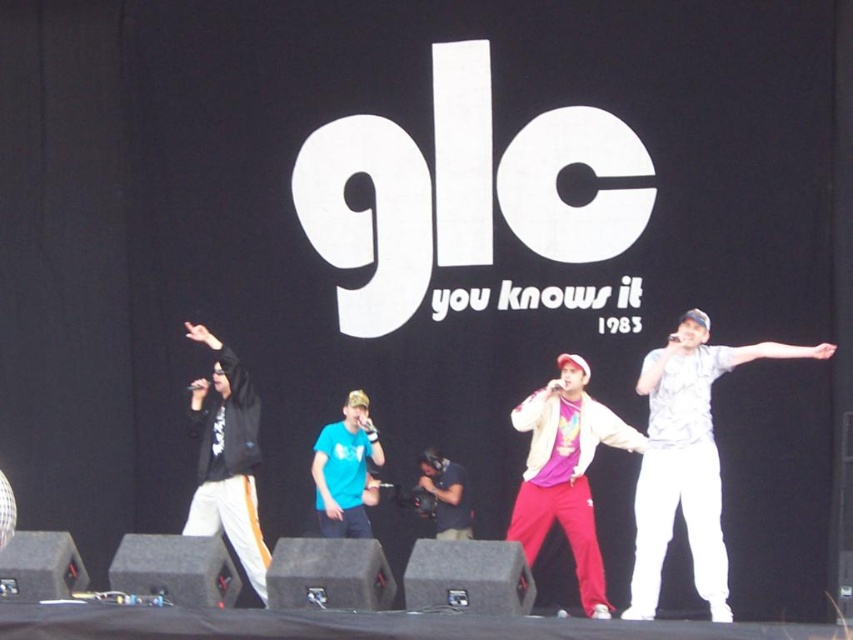
You are a photographer at the back of the venue and want to capture a clear photo of both the matte pink shirt at center and the black matte jacket at left. Considering their sizes, which one should you focus on first to ensure it fits within your camera frame?

The matte pink shirt at center is wider than the black matte jacket at left, so you should focus on capturing the matte pink shirt at center first to ensure it fits within your camera frame before adjusting for the smaller black matte jacket at left.

You are a photographer standing in the audience and want to take a picture of the two points on the stage. Which point, point (695, 401) or point (247, 512), will appear larger in your photo?

Point (695, 401) will appear larger in the photo because it is closer to the viewer than point (247, 512).